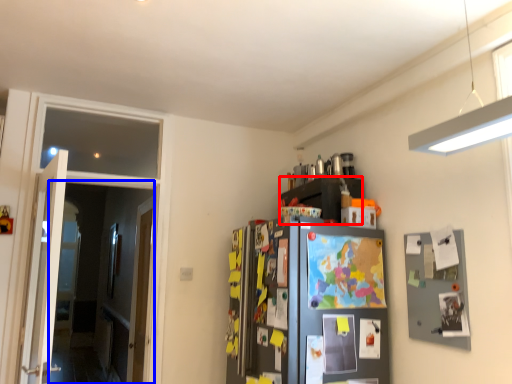
Question: Among these objects, which one is farthest to the camera, cabinetry (highlighted by a red box) or glass door (highlighted by a blue box)?

Choices:
 (A) cabinetry
 (B) glass door

Answer: (A)